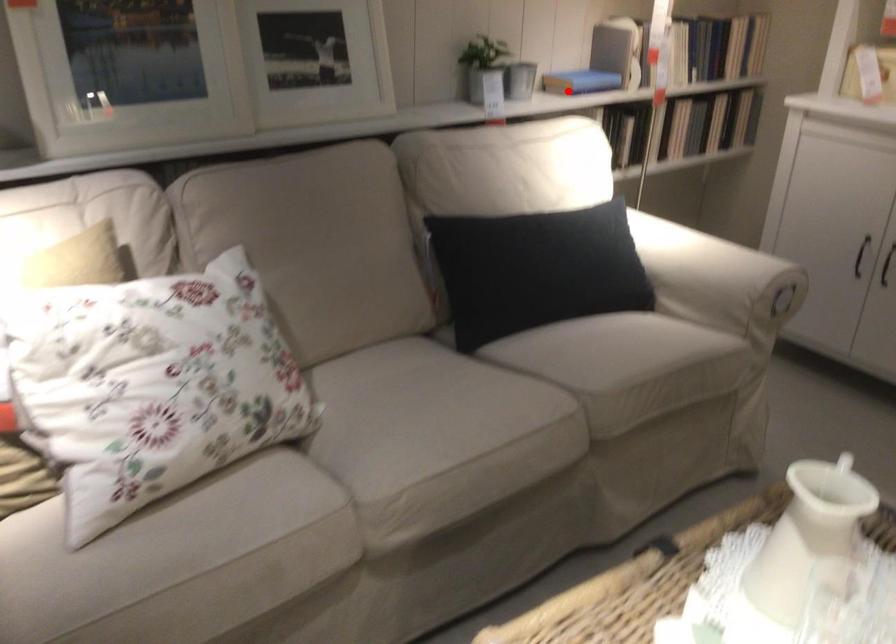
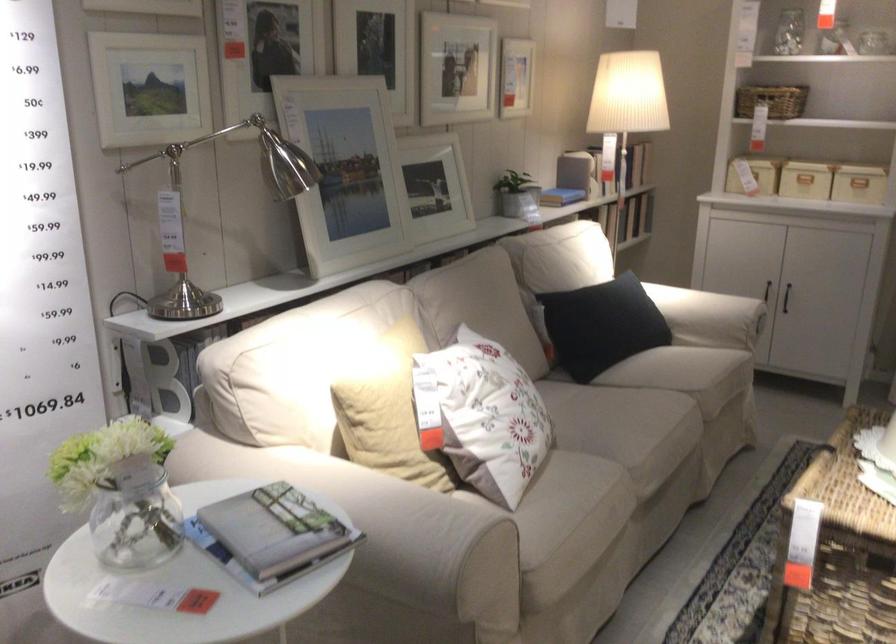
Find the pixel in the second image that matches the highlighted location in the first image.

(561, 194)